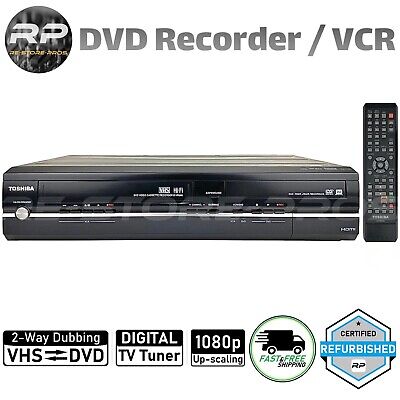
You are a GUI agent. You are given a task and a screenshot of the screen. Output one action in this format:
    pyautogui.click(x=<x>, y=<y>)
    Task: Click on the remote control
    
    Given the screenshot: What is the action you would take?
    pyautogui.click(x=373, y=119)